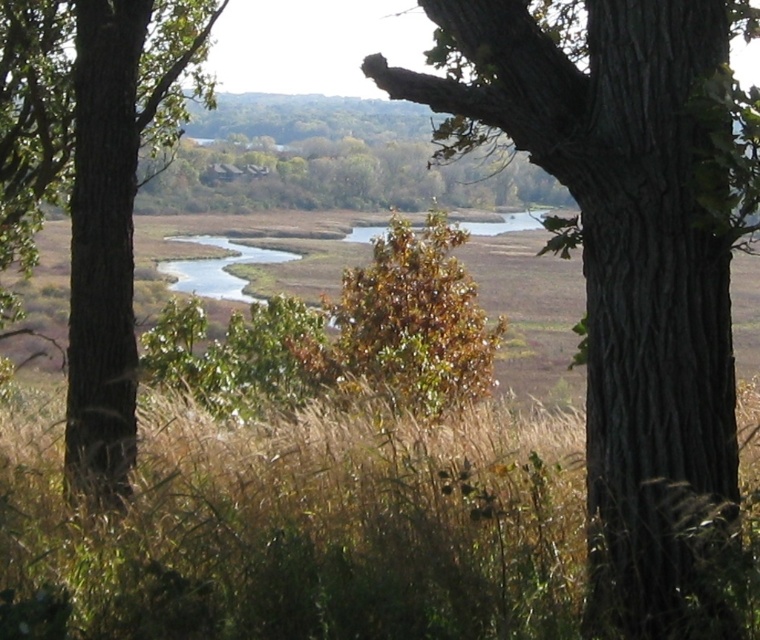
Question: Does smooth bark tree at center have a greater width compared to brown rough tree trunk at left?

Choices:
 (A) no
 (B) yes

Answer: (A)

Question: Which of these objects is positioned farthest from the brown grass at center?

Choices:
 (A) smooth bark tree at center
 (B) brown rough tree trunk at left

Answer: (B)

Question: Can you confirm if brown grass at center is bigger than brown rough tree trunk at left?

Choices:
 (A) yes
 (B) no

Answer: (B)

Question: Which point is closer to the camera taking this photo?

Choices:
 (A) (703, 368)
 (B) (2, 179)

Answer: (A)

Question: Does smooth bark tree at center appear over brown rough tree trunk at left?

Choices:
 (A) no
 (B) yes

Answer: (A)

Question: Which point is farther from the camera taking this photo?

Choices:
 (A) (192, 10)
 (B) (397, 547)
 (C) (599, 161)

Answer: (A)